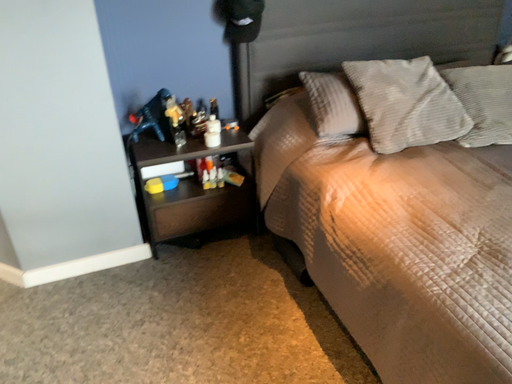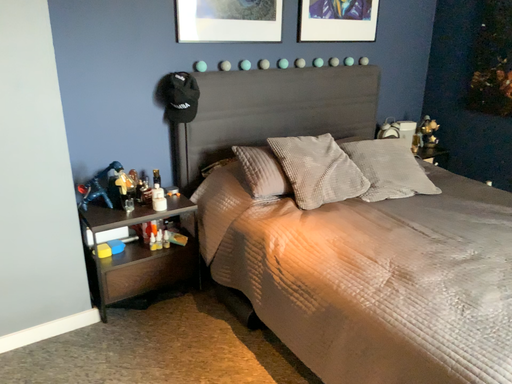
Question: How did the camera likely rotate when shooting the video?

Choices:
 (A) rotated left
 (B) rotated right

Answer: (B)